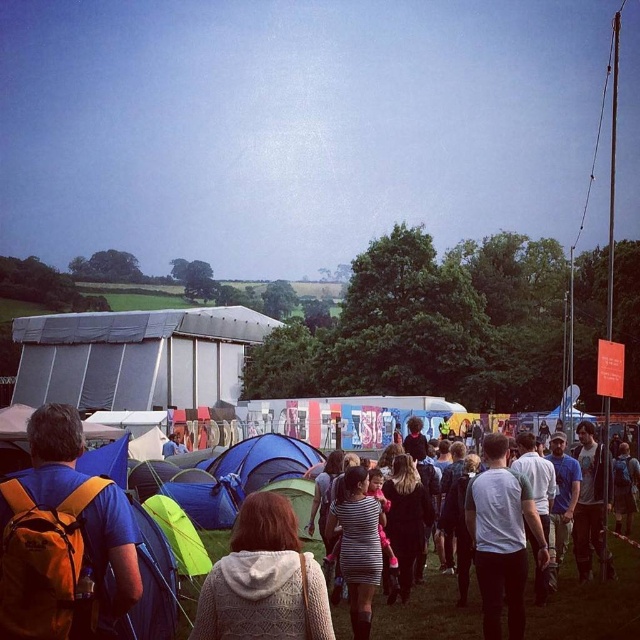
Question: Estimate the real-world distances between objects in this image. Which object is closer to the orange backpack at lower left?

Choices:
 (A) white cotton shirt at center
 (B) knitted beige sweater at center
 (C) striped fabric dress at center

Answer: (B)

Question: Estimate the real-world distances between objects in this image. Which object is closer to the white cotton shirt at center?

Choices:
 (A) knitted beige sweater at center
 (B) striped fabric dress at center
 (C) orange backpack at lower left

Answer: (B)

Question: Does orange backpack at lower left appear under white cotton shirt at center?

Choices:
 (A) no
 (B) yes

Answer: (A)

Question: Does orange backpack at lower left lie in front of white cotton shirt at center?

Choices:
 (A) yes
 (B) no

Answer: (A)

Question: Is knitted beige sweater at center behind white cotton shirt at center?

Choices:
 (A) no
 (B) yes

Answer: (A)

Question: Which point is closer to the camera taking this photo?

Choices:
 (A) (502, 545)
 (B) (84, 566)
 (C) (266, 560)

Answer: (B)